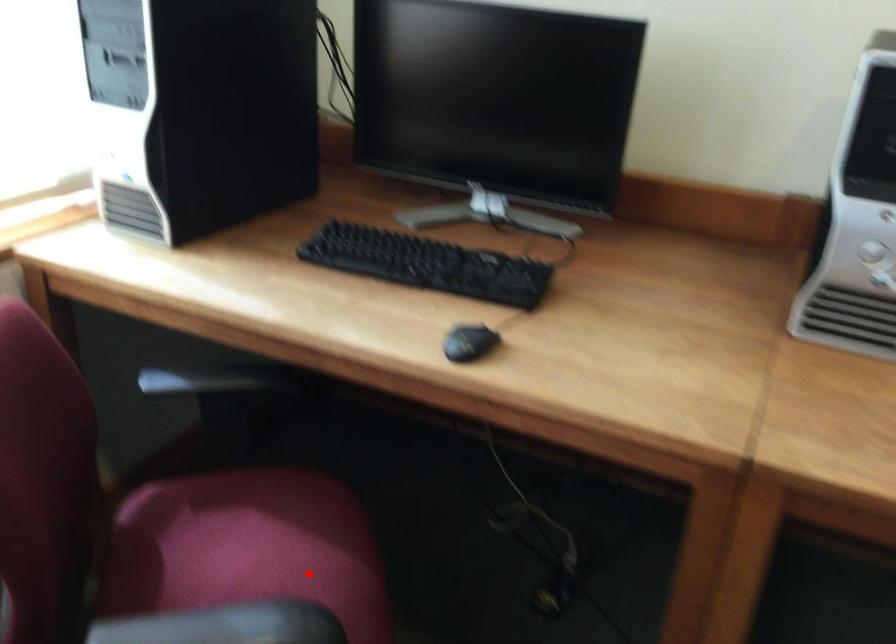
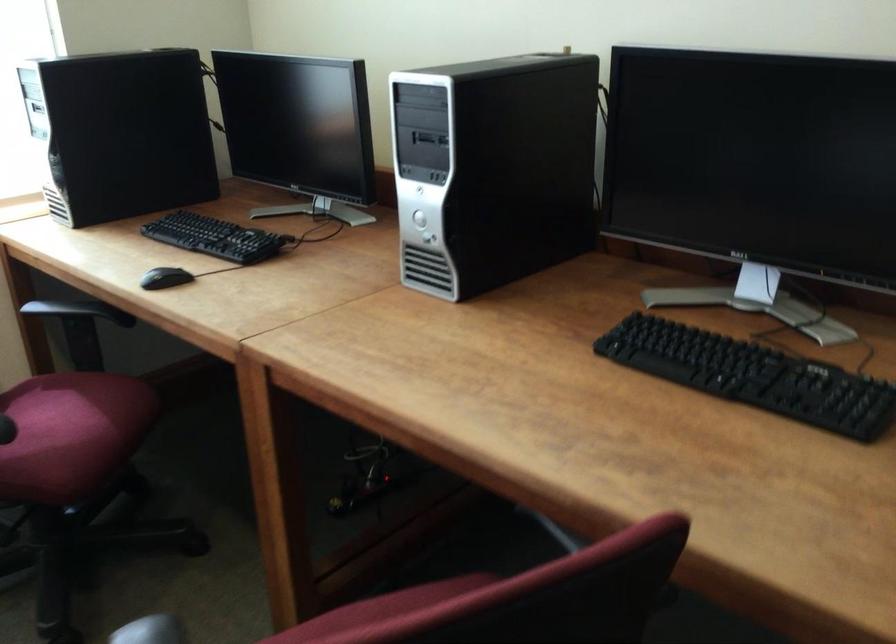
Question: I am providing you with two images of the same scene from different viewpoints. A red point is marked on the first image. Can you still see the location of the red point in image 2?

Choices:
 (A) Yes
 (B) No

Answer: (A)